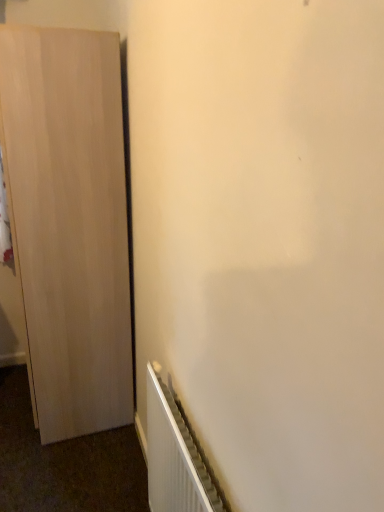
Question: Based on their sizes in the image, would you say light wood cupboard at left is bigger or smaller than white metallic radiator at lower right?

Choices:
 (A) big
 (B) small

Answer: (A)

Question: In terms of width, does light wood cupboard at left look wider or thinner when compared to white metallic radiator at lower right?

Choices:
 (A) wide
 (B) thin

Answer: (A)

Question: Which is correct: light wood cupboard at left is inside white metallic radiator at lower right, or outside of it?

Choices:
 (A) inside
 (B) outside

Answer: (B)

Question: Considering the positions of white metallic radiator at lower right and light wood cupboard at left in the image, is white metallic radiator at lower right taller or shorter than light wood cupboard at left?

Choices:
 (A) short
 (B) tall

Answer: (A)

Question: Is point (160, 500) closer or farther from the camera than point (66, 308)?

Choices:
 (A) closer
 (B) farther

Answer: (A)

Question: From the image's perspective, is white metallic radiator at lower right positioned above or below light wood cupboard at left?

Choices:
 (A) below
 (B) above

Answer: (A)

Question: In terms of width, does white metallic radiator at lower right look wider or thinner when compared to light wood cupboard at left?

Choices:
 (A) wide
 (B) thin

Answer: (B)